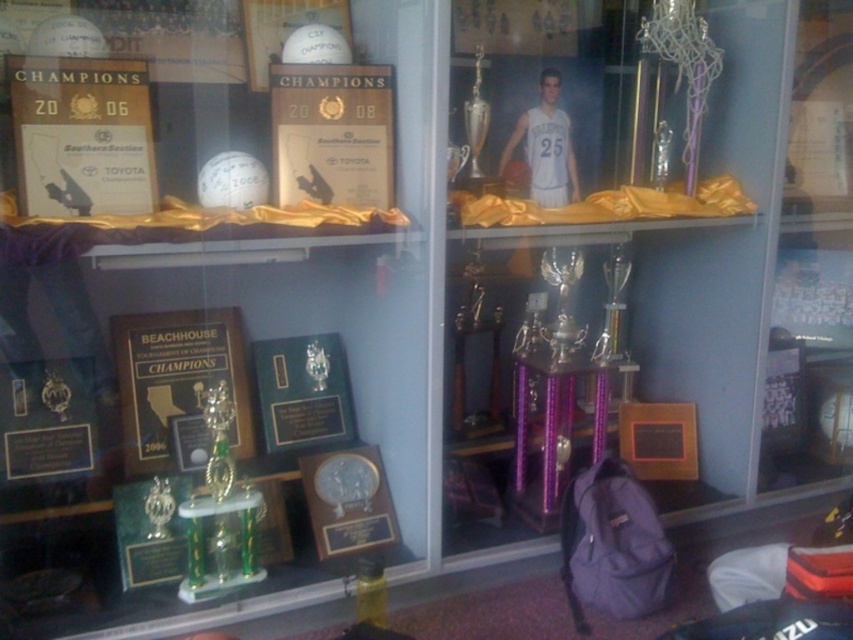
Who is taller, matte gold plaque at center or silver metallic trophy at center?

silver metallic trophy at center

Which is in front, point (376, 204) or point (480, 49)?

Positioned in front is point (376, 204).

This screenshot has width=853, height=640. I want to click on matte gold plaque at center, so click(332, 132).

This screenshot has width=853, height=640. I want to click on matte gold plaque at center, so click(332, 132).

Is green glossy plaque at center to the right of gold metallic trophy at center from the viewer's perspective?

No, green glossy plaque at center is not to the right of gold metallic trophy at center.

Does point (335, 380) come behind point (569, 272)?

No, it is not.

Does point (328, 408) come farther from viewer compared to point (569, 339)?

Yes.

The image size is (853, 640). In order to click on green glossy plaque at center in this screenshot , I will do `click(303, 392)`.

Does point (323, 497) come closer to viewer compared to point (320, 1)?

That is False.

Does gold plated plaque at center have a smaller size compared to white glossy plaque at upper center?

No.

Measure the distance between point [338,472] and camera.

They are 5.24 feet apart.

This screenshot has width=853, height=640. Find the location of `gold plated plaque at center`. gold plated plaque at center is located at coordinates (347, 500).